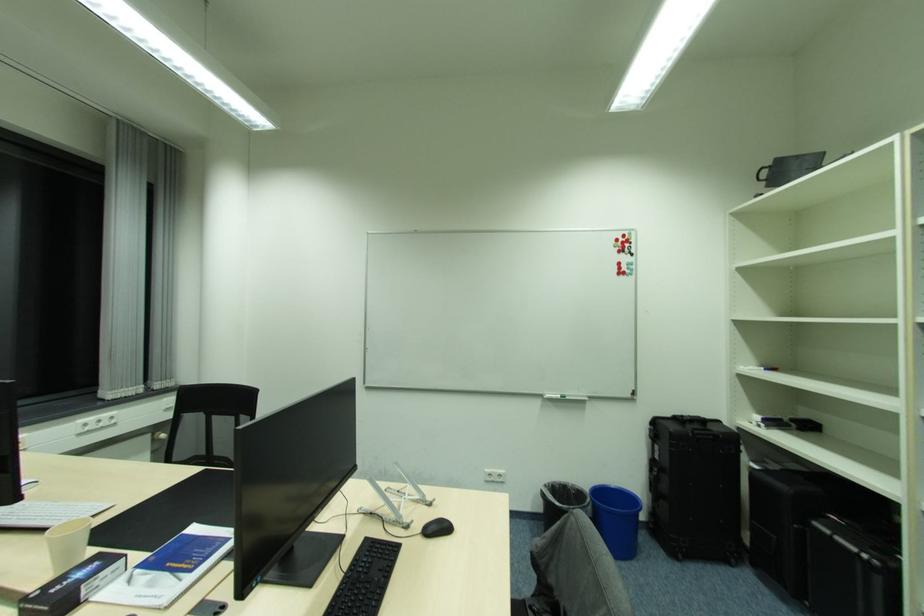
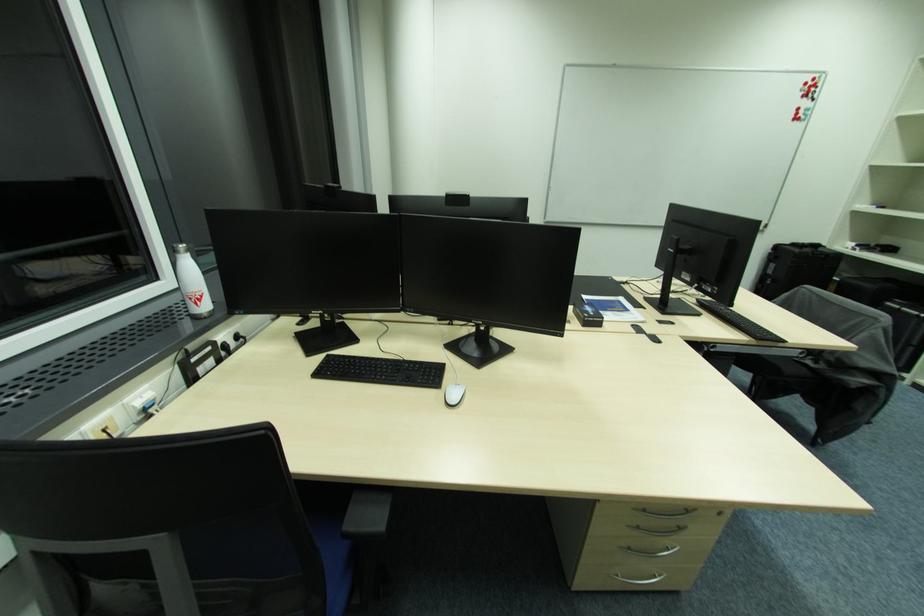
Question: What movement of the cameraman would produce the second image?

Choices:
 (A) Left
 (B) Right
 (C) Forward
 (D) Backward

Answer: (A)